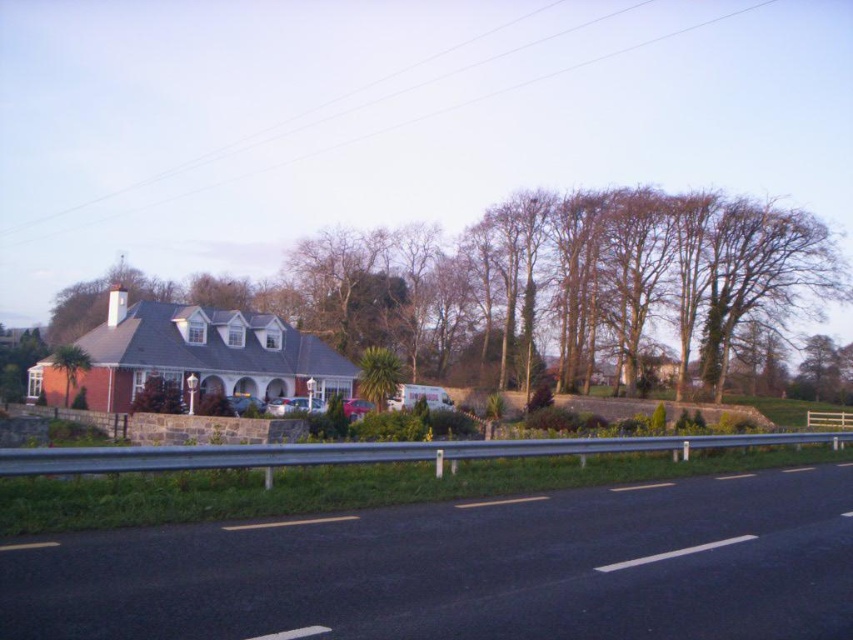
Question: Which object appears closest to the camera in this image?

Choices:
 (A) black asphalt road at lower center
 (B) green leafy tree at left

Answer: (A)

Question: Which point is farther to the camera?

Choices:
 (A) (563, 609)
 (B) (451, 301)
 (C) (67, 396)

Answer: (B)

Question: Estimate the real-world distances between objects in this image. Which object is farther from the black asphalt road at lower center?

Choices:
 (A) green leafy tree at left
 (B) brown textured tree at center

Answer: (B)

Question: Can you confirm if black asphalt road at lower center is positioned below brown textured tree at center?

Choices:
 (A) no
 (B) yes

Answer: (B)

Question: In this image, where is black asphalt road at lower center located relative to brown textured tree at center?

Choices:
 (A) right
 (B) left

Answer: (A)

Question: Does black asphalt road at lower center have a larger size compared to green leafy tree at left?

Choices:
 (A) yes
 (B) no

Answer: (A)